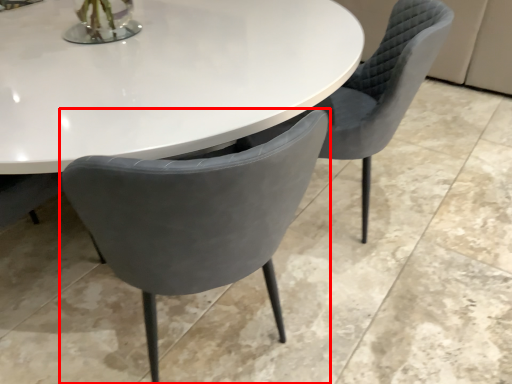
Question: Observing the image, what is the correct spatial positioning of chair (annotated by the red box) in reference to chair?

Choices:
 (A) right
 (B) left

Answer: (B)